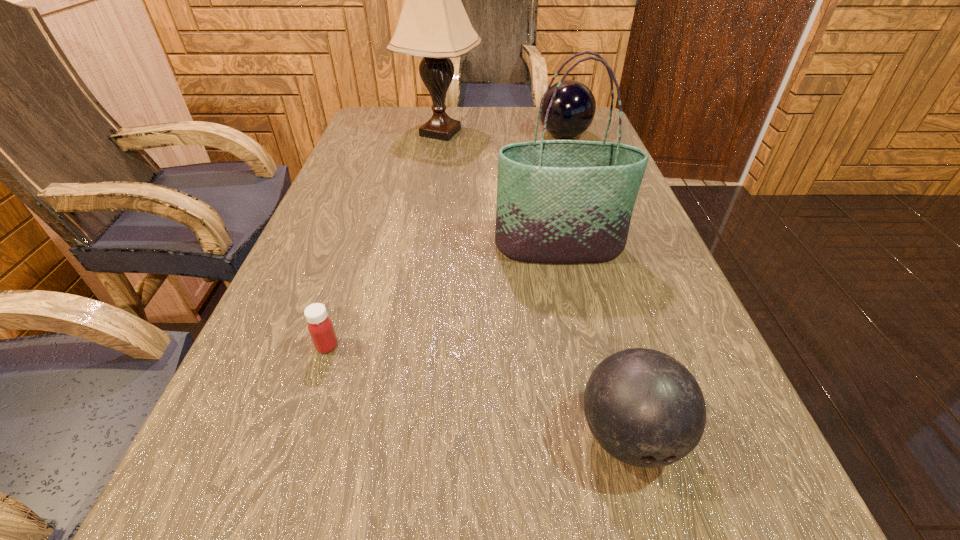
Locate an element on the screen. The height and width of the screenshot is (540, 960). object present at the far right corner is located at coordinates [x=573, y=109].

Find the location of a particular element. The height and width of the screenshot is (540, 960). vacant space at the far edge of the desktop is located at coordinates (479, 120).

In the image, there is a desktop. Where is `vacant space at the left edge`? vacant space at the left edge is located at coordinates (321, 204).

The height and width of the screenshot is (540, 960). I want to click on vacant space at the right edge of the desktop, so click(x=581, y=139).

This screenshot has width=960, height=540. Find the location of `vacant space at the far left corner of the desktop`. vacant space at the far left corner of the desktop is located at coordinates (408, 106).

At what (x,y) coordinates should I click in order to perform the action: click on vacant space in between the farther bowling ball and the nearest object. Please return your answer as a coordinate pair (x, y). The width and height of the screenshot is (960, 540). Looking at the image, I should click on (597, 286).

You are a GUI agent. You are given a task and a screenshot of the screen. Output one action in this format:
    pyautogui.click(x=<x>, y=<y>)
    Task: Click on the free space that is in between the shortest object and the tote bag
    
    Given the screenshot: What is the action you would take?
    pyautogui.click(x=444, y=297)

This screenshot has height=540, width=960. I want to click on vacant point located between the farther bowling ball and the medicine, so click(445, 241).

Find the location of a particular element. This screenshot has width=960, height=540. vacant space in between the medicine and the tote bag is located at coordinates (444, 297).

Image resolution: width=960 pixels, height=540 pixels. Identify the location of vacant space that's between the nearer bowling ball and the farther bowling ball. (597, 286).